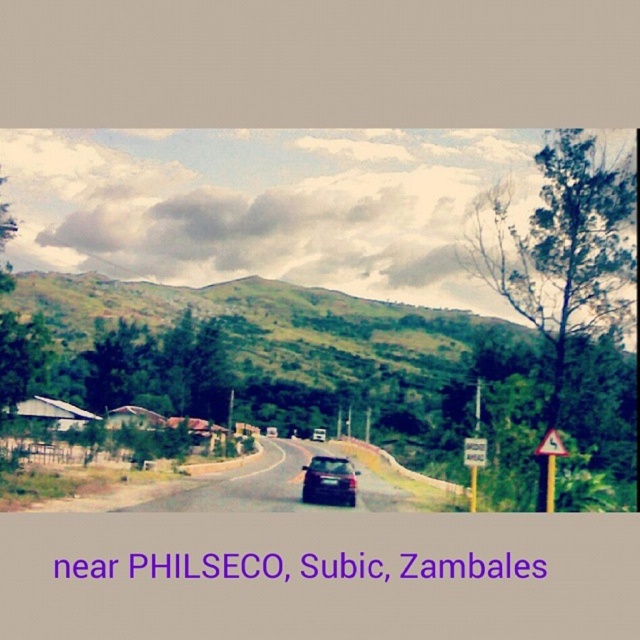
Question: Is satin black car at center wider than yellow plastic triangle at right?

Choices:
 (A) no
 (B) yes

Answer: (B)

Question: Is satin black car at center further to camera compared to yellow plastic triangle at right?

Choices:
 (A) no
 (B) yes

Answer: (B)

Question: Among these points, which one is farthest from the camera?

Choices:
 (A) (342, 458)
 (B) (547, 468)

Answer: (A)

Question: Which of the following is the closest to the observer?

Choices:
 (A) satin black car at center
 (B) yellow plastic triangle at right

Answer: (B)

Question: Can you confirm if satin black car at center is wider than yellow plastic triangle at right?

Choices:
 (A) yes
 (B) no

Answer: (A)

Question: Which object is closer to the camera taking this photo?

Choices:
 (A) satin black car at center
 (B) yellow plastic triangle at right

Answer: (B)